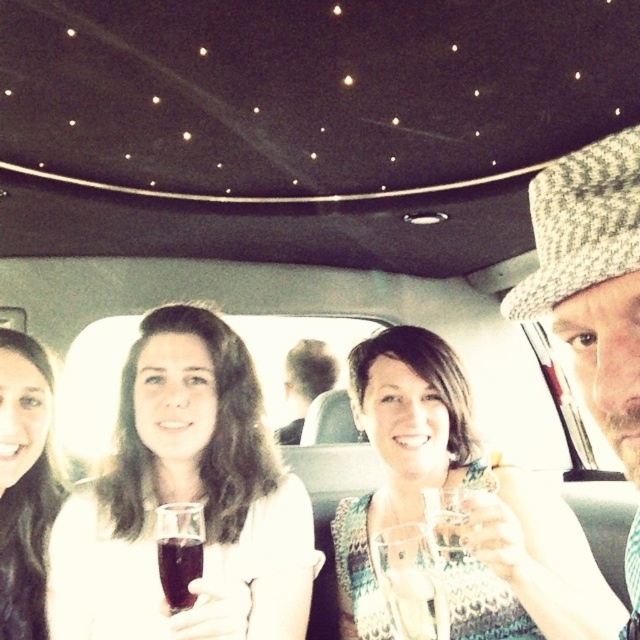
Between patterned fabric dress at center and smooth brown hair at left, which one appears on the right side from the viewer's perspective?

Positioned to the right is patterned fabric dress at center.

Can you confirm if patterned fabric dress at center is positioned below smooth brown hair at left?

Indeed, patterned fabric dress at center is positioned under smooth brown hair at left.

This screenshot has height=640, width=640. Identify the location of patterned fabric dress at center. (468, 512).

This screenshot has height=640, width=640. I want to click on patterned fabric dress at center, so click(x=468, y=512).

Does matte white shirt at center have a greater width compared to patterned fabric dress at center?

Correct, the width of matte white shirt at center exceeds that of patterned fabric dress at center.

The image size is (640, 640). What are the coordinates of `matte white shirt at center` in the screenshot? It's located at (186, 500).

Who is more distant from viewer, (x=624, y=209) or (x=406, y=588)?

The point (x=406, y=588) is more distant.

Between point (602, 170) and point (385, 577), which one is positioned in front?

Point (602, 170) is more forward.

The image size is (640, 640). I want to click on knitted wool hat at right, so click(x=592, y=280).

Identify the location of knitted wool hat at right. (592, 280).